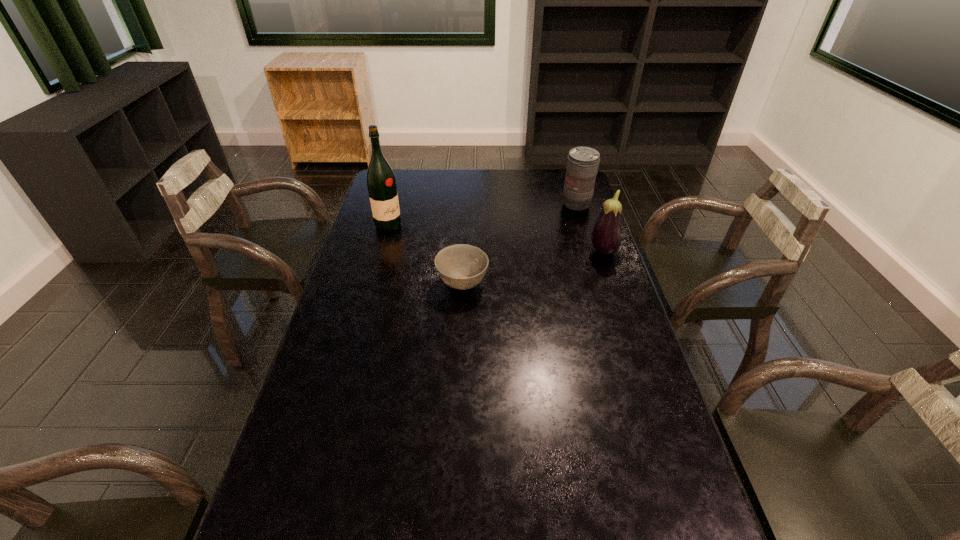
At what (x,y) coordinates should I click in order to perform the action: click on unoccupied area between the shortest object and the tallest object. Please return your answer as a coordinate pair (x, y). Image resolution: width=960 pixels, height=540 pixels. Looking at the image, I should click on (425, 254).

The width and height of the screenshot is (960, 540). Identify the location of the second closest object to the eggplant. (461, 266).

The width and height of the screenshot is (960, 540). I want to click on the second closest object to the shortest object, so click(x=606, y=237).

Find the location of `free spot that satisfies the following two spatial constraints: 1. on the front side of the nearest object; 2. on the left side of the tallest object`. free spot that satisfies the following two spatial constraints: 1. on the front side of the nearest object; 2. on the left side of the tallest object is located at coordinates (372, 284).

Where is `vacant area in the image that satisfies the following two spatial constraints: 1. on the back side of the farthest object; 2. on the right side of the shortest object`? vacant area in the image that satisfies the following two spatial constraints: 1. on the back side of the farthest object; 2. on the right side of the shortest object is located at coordinates (466, 204).

You are a GUI agent. You are given a task and a screenshot of the screen. Output one action in this format:
    pyautogui.click(x=<x>, y=<y>)
    Task: Click on the vacant point that satisfies the following two spatial constraints: 1. on the front side of the telephoto lens; 2. on the right side of the third farthest object
    
    Given the screenshot: What is the action you would take?
    pyautogui.click(x=591, y=252)

Where is `free spot that satisfies the following two spatial constraints: 1. on the front side of the telephoto lens; 2. on the right side of the eggplant`? Image resolution: width=960 pixels, height=540 pixels. free spot that satisfies the following two spatial constraints: 1. on the front side of the telephoto lens; 2. on the right side of the eggplant is located at coordinates (591, 252).

Image resolution: width=960 pixels, height=540 pixels. Identify the location of vacant space that satisfies the following two spatial constraints: 1. on the front side of the nearest object; 2. on the left side of the leftmost object. (372, 284).